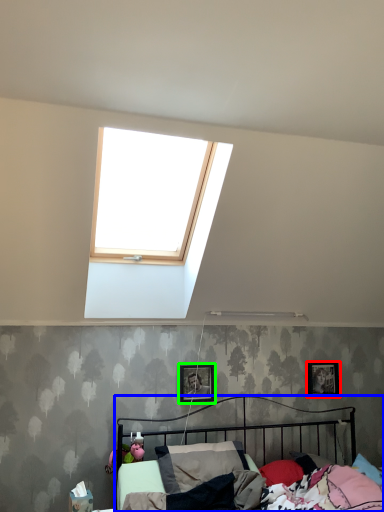
Question: Estimate the real-world distances between objects in this image. Which object is farther from picture frame (highlighted by a red box), bed (highlighted by a blue box) or picture frame (highlighted by a green box)?

Choices:
 (A) bed
 (B) picture frame

Answer: (B)